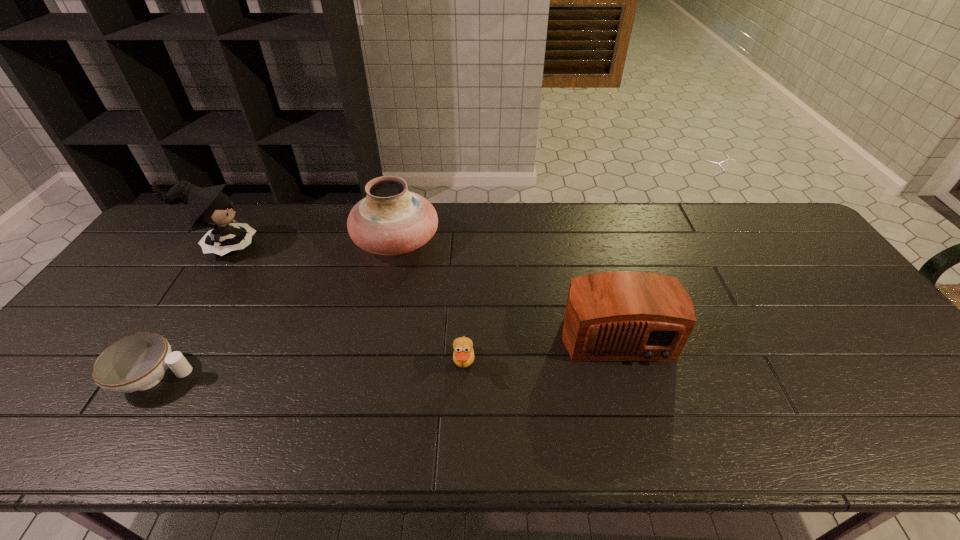
At what (x,y) coordinates should I click in order to perform the action: click on doll. Please return your answer as a coordinate pair (x, y). Image resolution: width=960 pixels, height=540 pixels. Looking at the image, I should click on (210, 207).

Find the location of `the second tallest object`. the second tallest object is located at coordinates (390, 220).

Where is `pottery`? This screenshot has height=540, width=960. pottery is located at coordinates (390, 220).

Find the location of a particular element. The image size is (960, 540). the rightmost object is located at coordinates [x=622, y=315].

Find the location of `radio receiver`. radio receiver is located at coordinates (622, 315).

The width and height of the screenshot is (960, 540). In order to click on duck in this screenshot , I will do (463, 356).

Find the location of a particular element. the second shortest object is located at coordinates (463, 356).

Where is `chinaware`? chinaware is located at coordinates (138, 362).

Identify the location of vacant area situated at the face of the doll. The width and height of the screenshot is (960, 540). (302, 247).

Find the location of a particular element. This screenshot has width=960, height=540. free region located 0.150m on the front of the fourth shortest object is located at coordinates (382, 308).